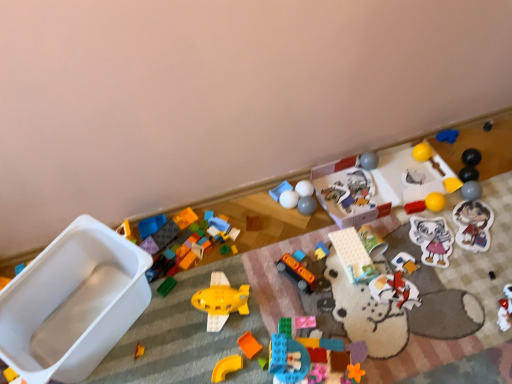
Locate an element on the screen. vacant space that is to the left of orange matte bus at center, the sixteenth toy in the right-to-left sequence is located at coordinates (253, 286).